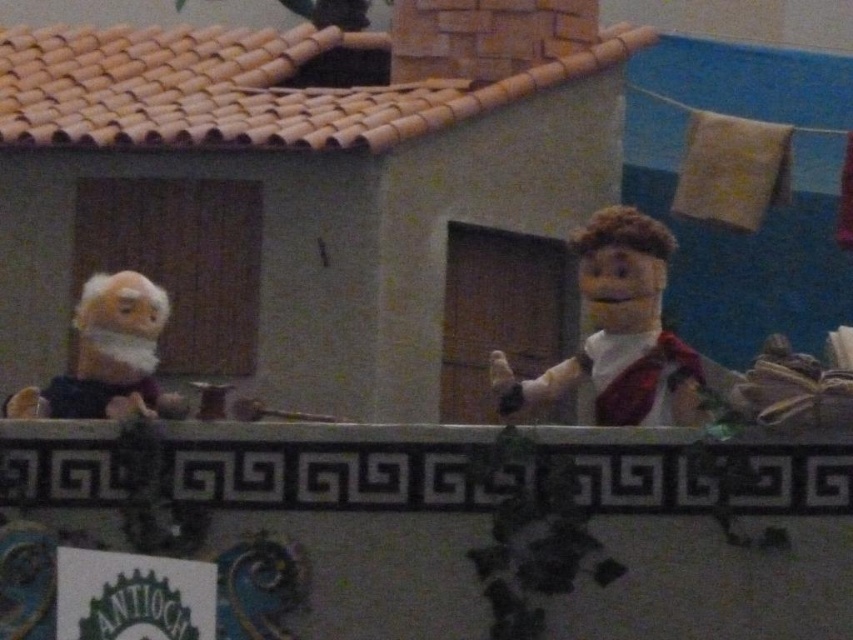
You are a spectator at a puppet show and notice two characters on stage. The white fabric puppet at center and the white plush monkey at left. Which one is positioned higher?

The white fabric puppet at center is positioned higher than the white plush monkey at left.

You are a visitor at a puppet show and see the white fabric puppet at center and the white plush monkey at left. Which puppet is positioned more to the left side of the stage?

The white plush monkey at left is positioned more to the left side of the stage than the white fabric puppet at center.